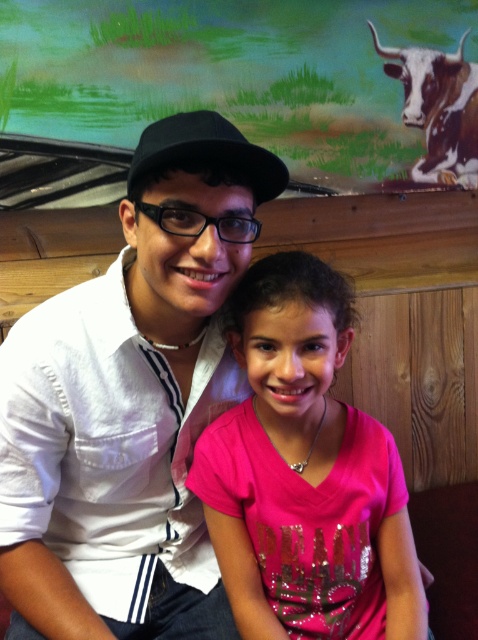
Question: Does pink shiny shirt at center appear under brown and white textured bull at upper right?

Choices:
 (A) yes
 (B) no

Answer: (A)

Question: Among these objects, which one is farthest from the camera?

Choices:
 (A) black matte baseball hat at upper center
 (B) pink shiny shirt at center
 (C) white matte shirt at center

Answer: (B)

Question: Which object is the closest to the pink shiny shirt at center?

Choices:
 (A) black matte baseball hat at upper center
 (B) brown and white textured bull at upper right

Answer: (A)

Question: Among these points, which one is nearest to the camera?

Choices:
 (A) (441, 65)
 (B) (180, 316)
 (C) (274, 182)
 (D) (296, 525)

Answer: (C)

Question: Does white matte shirt at center have a smaller size compared to black matte baseball hat at upper center?

Choices:
 (A) no
 (B) yes

Answer: (A)

Question: Is white matte shirt at center positioned behind pink shiny shirt at center?

Choices:
 (A) yes
 (B) no

Answer: (B)